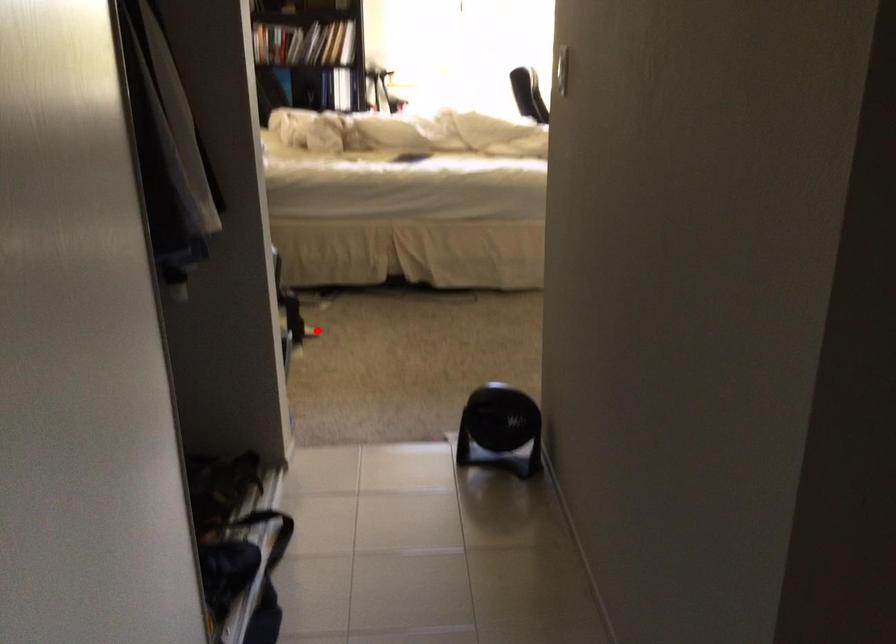
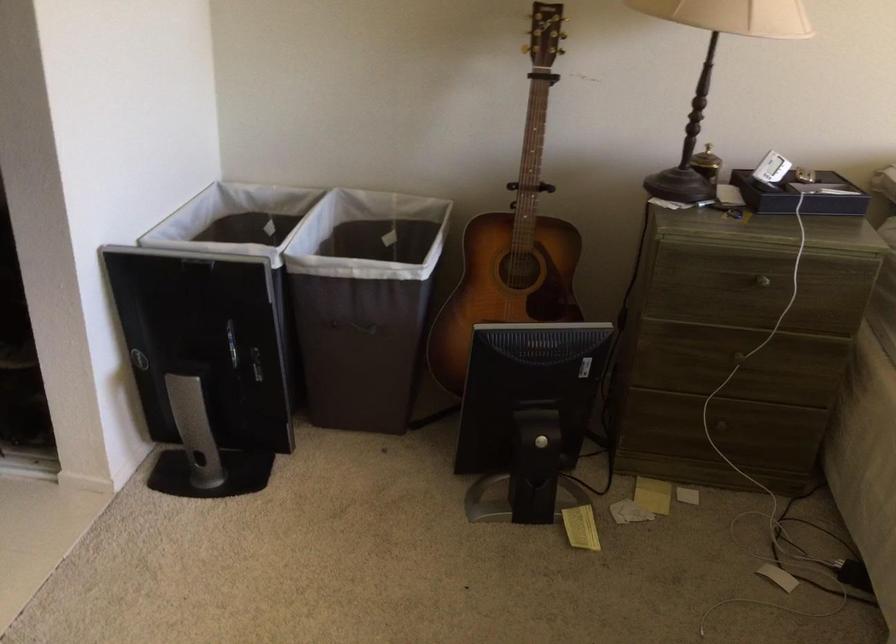
Question: I am providing you with two images of the same scene from different viewpoints. In image1, a red point is highlighted. Considering the same 3D point in image2, which of the following is correct?

Choices:
 (A) It is closer
 (B) It is farther

Answer: (A)